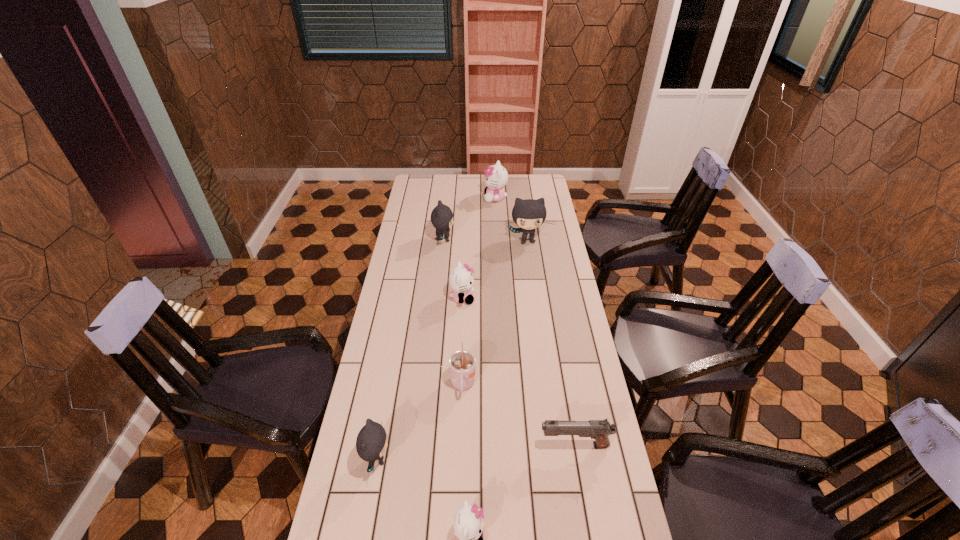
You are a GUI agent. You are given a task and a screenshot of the screen. Output one action in this format:
    pyautogui.click(x=<x>, y=<y>)
    Task: Click on the vacant space situated 0.100m in the direction the gun is aimed
    This screenshot has width=960, height=540.
    Given the screenshot: What is the action you would take?
    pyautogui.click(x=505, y=446)

Locate an element on the screen. object positioned at the far edge is located at coordinates (496, 177).

Where is `kitten that is at the right edge`? This screenshot has height=540, width=960. kitten that is at the right edge is located at coordinates (529, 214).

Find the location of `gun positioned at the right edge`. gun positioned at the right edge is located at coordinates (599, 430).

Locate an element on the screen. The width and height of the screenshot is (960, 540). vacant space at the left edge is located at coordinates (x=399, y=424).

Identify the location of vacant point at the right edge. Image resolution: width=960 pixels, height=540 pixels. (589, 360).

I want to click on vacant point located between the cup and the farthest object, so click(x=479, y=292).

Locate an element on the screen. free space between the gun and the leftmost gray kitten is located at coordinates (476, 453).

This screenshot has height=540, width=960. I want to click on free space between the biggest gray kitten and the gun, so click(x=551, y=343).

I want to click on unoccupied position between the cup and the gun, so click(518, 415).